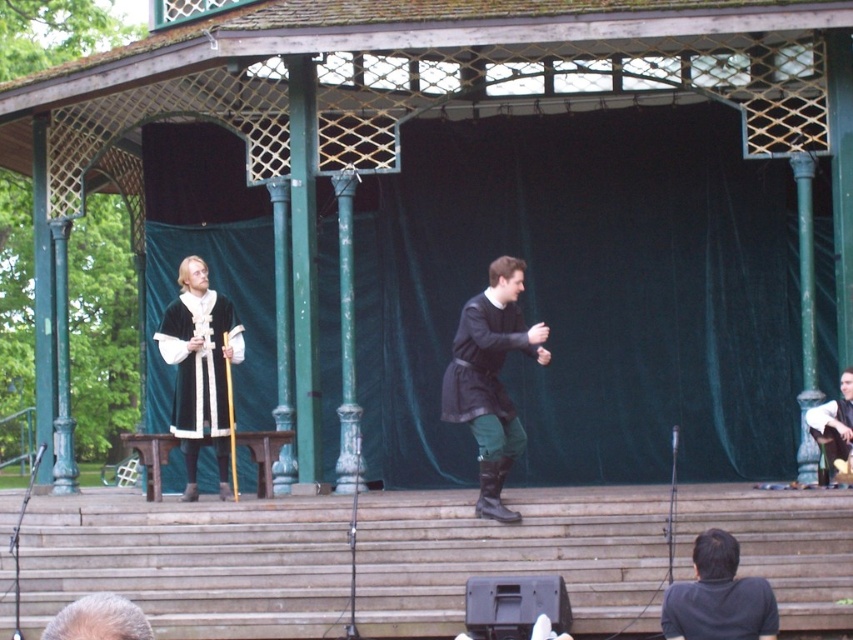
Question: Which of the following is the closest to the observer?

Choices:
 (A) (769, 630)
 (B) (221, 470)

Answer: (A)

Question: Which of these objects is positioned farthest from the matte black tunic at center?

Choices:
 (A) velvet black robe at center
 (B) dark gray sweater at lower right
 (C) smooth brown leather jacket at right

Answer: (B)

Question: Does velvet black robe at center appear on the right side of smooth brown leather jacket at right?

Choices:
 (A) yes
 (B) no

Answer: (B)

Question: Considering the real-world distances, which object is closest to the matte black tunic at center?

Choices:
 (A) velvet black robe at center
 (B) dark gray sweater at lower right
 (C) smooth brown leather jacket at right

Answer: (C)

Question: Is matte black tunic at center further to the viewer compared to velvet black robe at center?

Choices:
 (A) no
 (B) yes

Answer: (A)

Question: Is matte black tunic at center above dark gray sweater at lower right?

Choices:
 (A) no
 (B) yes

Answer: (B)